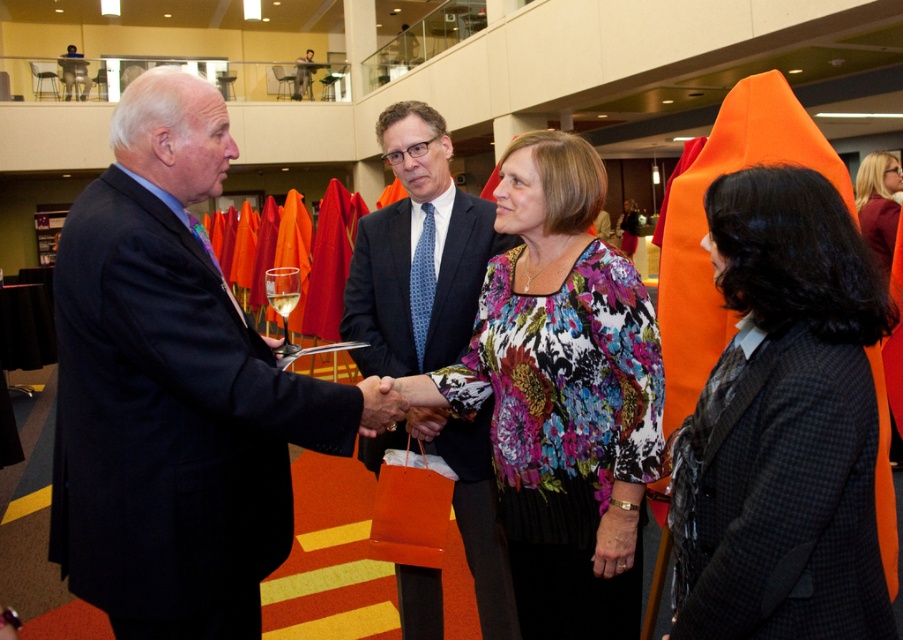
Which is in front, point (733, 616) or point (492, 589)?

Point (733, 616) is in front.

Find the location of a particular element. The height and width of the screenshot is (640, 903). black textured blazer at right is located at coordinates coord(783,426).

Who is more distant from viewer, (81, 493) or (545, 259)?

Positioned behind is point (545, 259).

Between dark suit at left and floral print blouse at center, which one is positioned lower?

floral print blouse at center

Between point (144, 628) and point (622, 509), which one is positioned behind?

The point (622, 509) is behind.

At what (x,y) coordinates should I click in order to perform the action: click on dark suit at left. Please return your answer as a coordinate pair (x, y). Looking at the image, I should click on (174, 388).

Can you confirm if blue dotted tie at center is positioned below black textured hair at upper right?

Yes, blue dotted tie at center is below black textured hair at upper right.

Which is more to the left, blue dotted tie at center or black textured hair at upper right?

blue dotted tie at center

Is point (500, 637) more distant than point (888, 256)?

No, (500, 637) is closer to viewer.

Where is `blue dotted tie at center`? This screenshot has height=640, width=903. blue dotted tie at center is located at coordinates (417, 253).